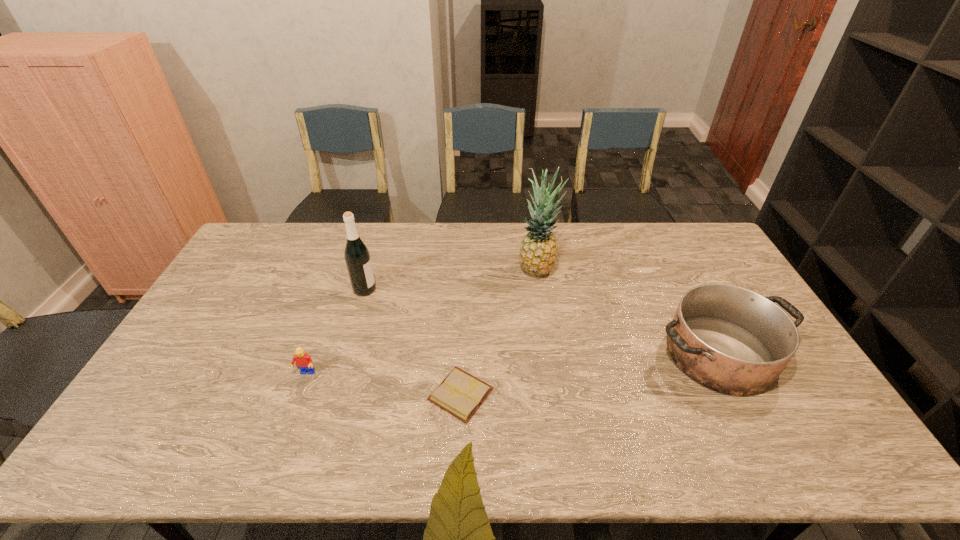
Locate an element on the screen. The height and width of the screenshot is (540, 960). free space located on the left of the second object from right to left is located at coordinates pos(412,269).

Where is `free space located 0.220m on the label of the second tallest object`? This screenshot has height=540, width=960. free space located 0.220m on the label of the second tallest object is located at coordinates (443, 289).

Locate an element on the screen. This screenshot has height=540, width=960. vacant area located 0.170m on the left of the rightmost object is located at coordinates (591, 354).

What are the coordinates of `free space located 0.160m on the front-facing side of the Lego` in the screenshot? It's located at (284, 433).

I want to click on free space located on the left of the diary, so [x=408, y=394].

Where is `object at the far edge`? Image resolution: width=960 pixels, height=540 pixels. object at the far edge is located at coordinates (538, 253).

Locate an element on the screen. Image resolution: width=960 pixels, height=540 pixels. object that is at the right edge is located at coordinates (732, 340).

The image size is (960, 540). I want to click on free space at the far edge of the desktop, so point(329,250).

This screenshot has width=960, height=540. Find the location of `vacant space at the near edge of the desktop`. vacant space at the near edge of the desktop is located at coordinates (378, 452).

Identify the location of free point at the left edge. This screenshot has height=540, width=960. (169, 381).